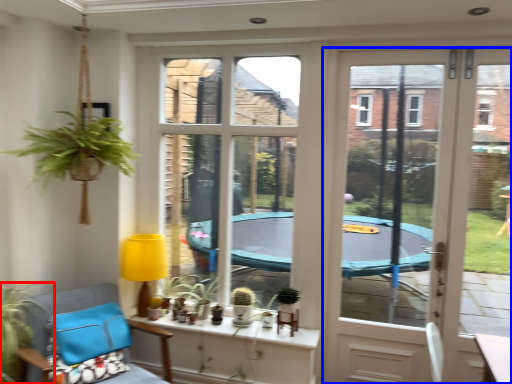
Question: Which of the following is the closest to the observer, houseplant (highlighted by a red box) or door (highlighted by a blue box)?

Choices:
 (A) houseplant
 (B) door

Answer: (A)